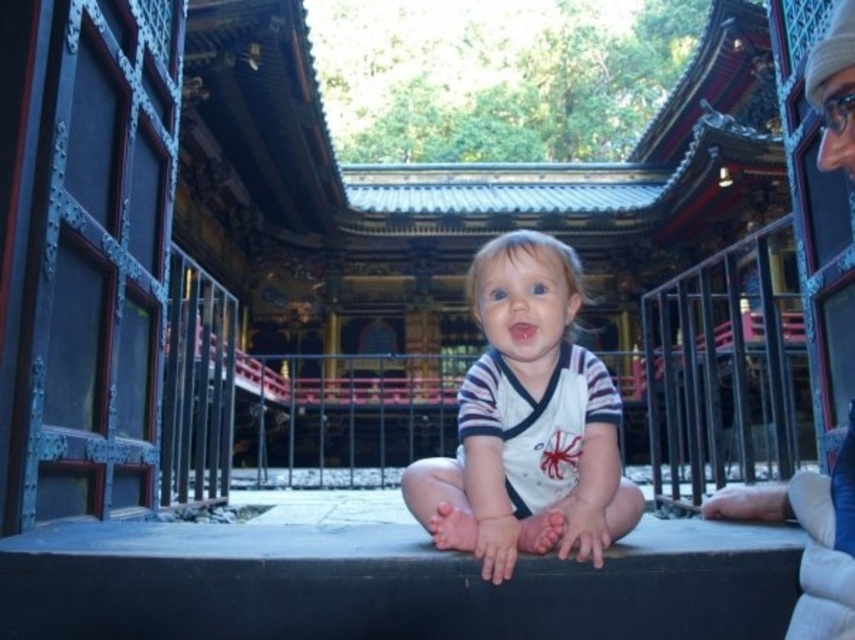
Question: Does white cotton shirt at center have a smaller size compared to white knit hat at upper right?

Choices:
 (A) yes
 (B) no

Answer: (B)

Question: In this image, where is white cotton shirt at center located relative to white knit hat at upper right?

Choices:
 (A) left
 (B) right

Answer: (A)

Question: Among these objects, which one is nearest to the camera?

Choices:
 (A) white knit hat at upper right
 (B) white cotton shirt at center

Answer: (A)

Question: Which point is closer to the camera?

Choices:
 (A) (508, 348)
 (B) (821, 480)

Answer: (B)

Question: Can you confirm if white cotton shirt at center is wider than white knit hat at upper right?

Choices:
 (A) no
 (B) yes

Answer: (B)

Question: Which of the following is the farthest from the observer?

Choices:
 (A) (528, 432)
 (B) (848, 524)

Answer: (A)